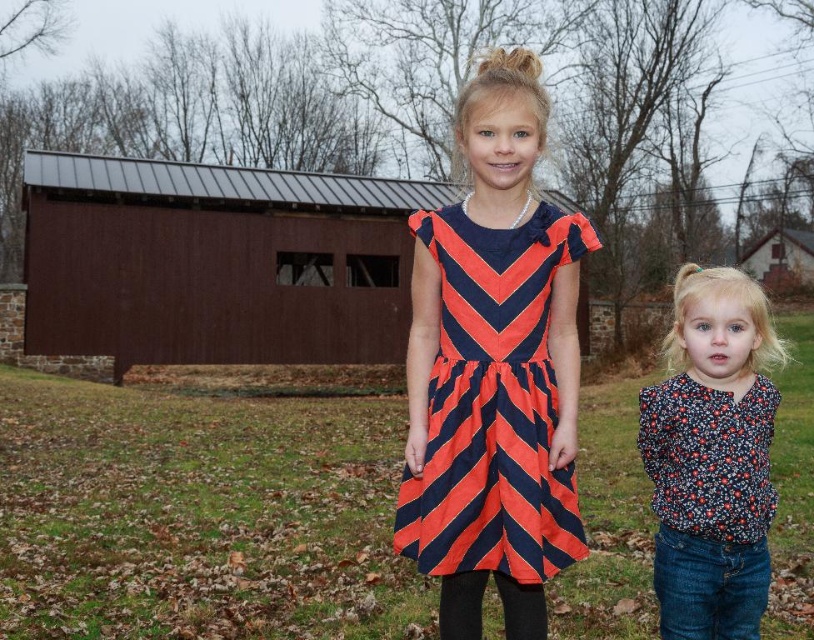
Question: Which point appears closest to the camera in this image?

Choices:
 (A) (138, 305)
 (B) (482, 442)
 (C) (769, 515)

Answer: (B)

Question: Can you confirm if orange and navy striped dress at center is positioned below floral print blouse at lower right?

Choices:
 (A) no
 (B) yes

Answer: (A)

Question: Is brown wooden barn at center below floral print blouse at lower right?

Choices:
 (A) yes
 (B) no

Answer: (B)

Question: Is brown wooden barn at center to the right of floral print blouse at lower right from the viewer's perspective?

Choices:
 (A) no
 (B) yes

Answer: (A)

Question: Which object is the closest to the floral print blouse at lower right?

Choices:
 (A) orange and navy striped dress at center
 (B) brown wooden barn at center

Answer: (A)

Question: Which point is farther to the camera?

Choices:
 (A) (475, 237)
 (B) (694, 369)
 (C) (177, 252)

Answer: (C)